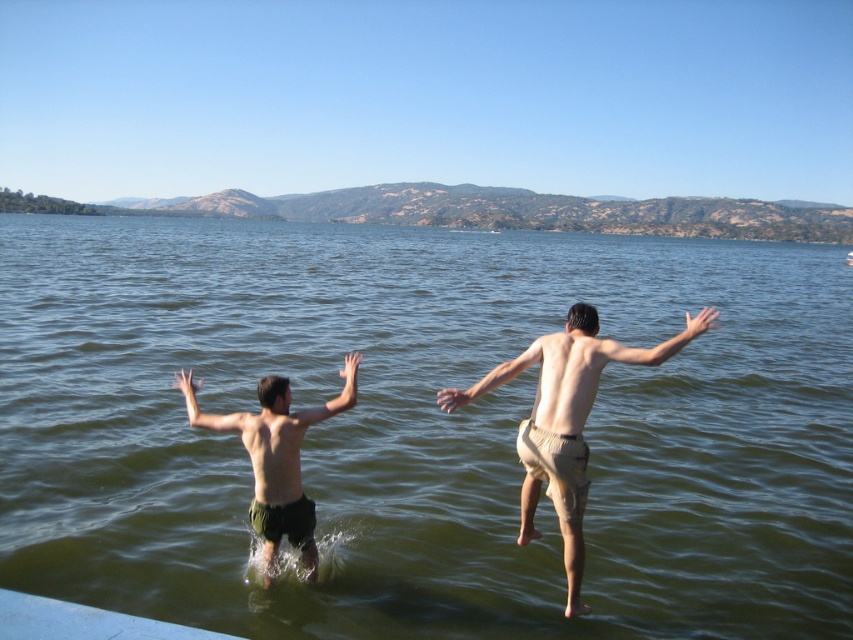
You are standing on the dock and want to jump into the green water at center. Which direction should you jump to reach it?

You should jump towards the center of the water to reach the green water at center, as it is located at point coordinates (422, 428).

You are a photographer standing at the edge of the water. You want to take a photo of both the tan fabric shorts at center and the dark green shorts at left. Which one is closer to the water surface?

The tan fabric shorts at center has a lesser height compared to dark green shorts at left, so it is closer to the water surface.

You are a photographer trying to capture the perfect shot of the green water at center and the tan fabric shorts at center. Which object in the scene takes up more space in the frame?

The green water at center takes up more space in the frame because it is bigger than the tan fabric shorts at center.